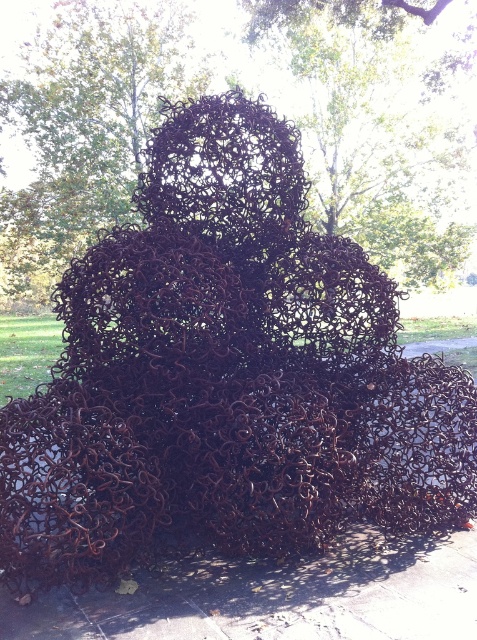
You are standing in a park and see the rusty wire sculpture at center. If you walk straight ahead, will you eventually reach the point at coordinates (x=379, y=132)?

Yes, because the point at coordinates (x=379, y=132) is exactly where the rusty wire sculpture at center is located.

Based on the photo, you are an artist planning to install a new sculpture in a park. You observe the existing rusty wire sculpture at center and the gray concrete pavement at lower center. Considering their heights, which object would require a taller base to ensure visibility from a distance?

The rusty wire sculpture at center is much taller than the gray concrete pavement at lower center, so it would require a taller base to ensure visibility from a distance.